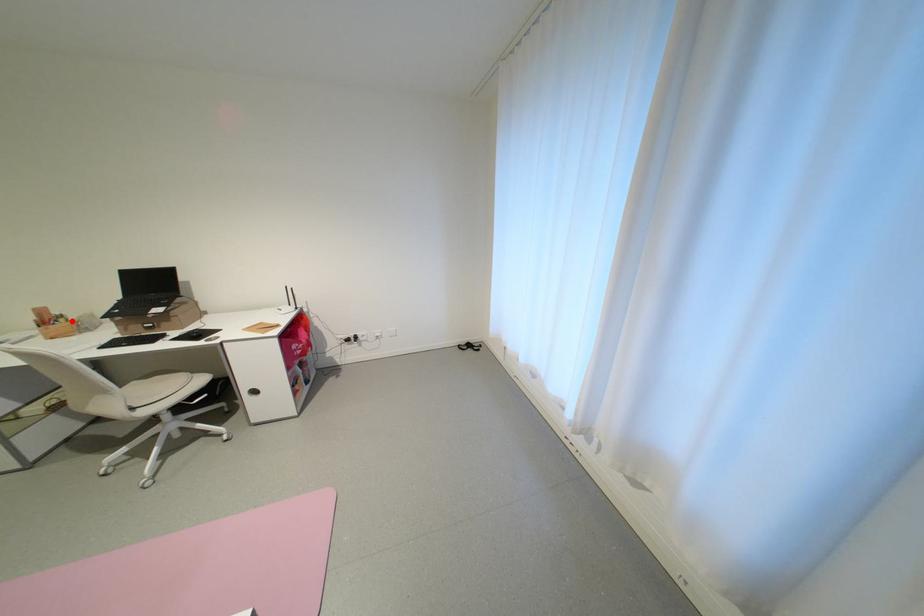
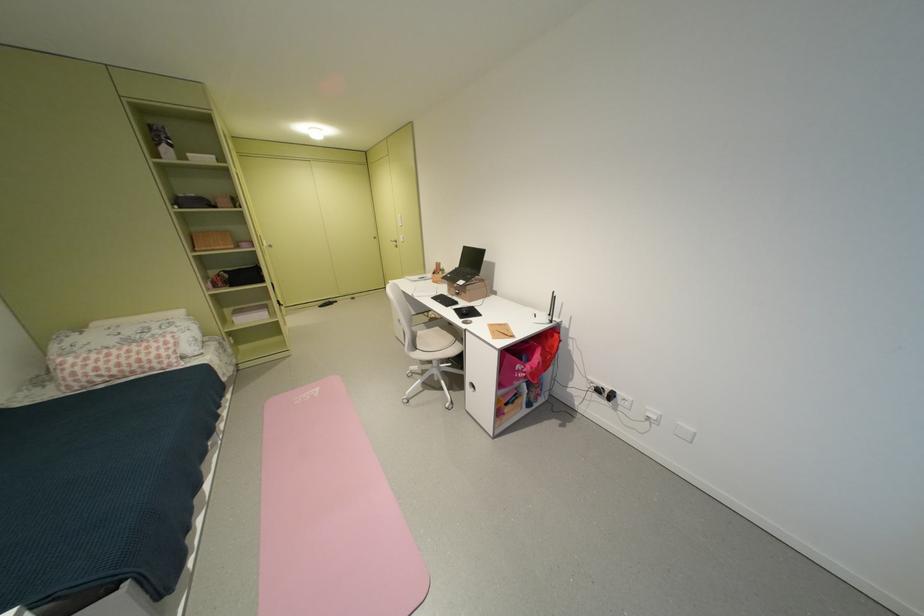
Question: I am providing you with two images of the same scene from different viewpoints. A red point is shown in image1. For the corresponding object point in image2, is it positioned nearer or farther from the camera?

Choices:
 (A) Nearer
 (B) Farther

Answer: (B)